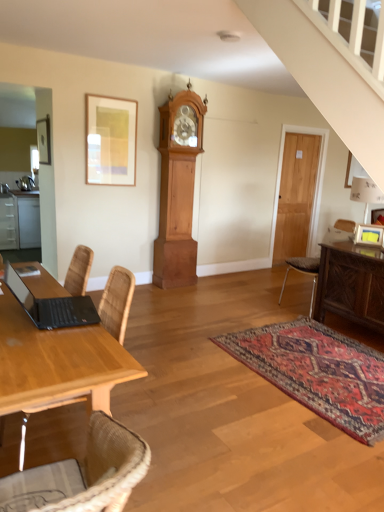
Question: Relative to wooden door at right, is wooden table at left in front or behind?

Choices:
 (A) front
 (B) behind

Answer: (A)

Question: Do you think wooden table at left is within wooden door at right, or outside of it?

Choices:
 (A) outside
 (B) inside

Answer: (A)

Question: Which of these objects is positioned closest to the wooden door at right?

Choices:
 (A) satin white cabinets at left
 (B) brown leather chair at right
 (C) matte gold picture frame at upper left
 (D) light brown wood grandfather clock at center
 (E) carved wood sideboard at right

Answer: (D)

Question: Which object is the closest to the matte gold picture frame at upper left?

Choices:
 (A) satin white cabinets at left
 (B) carved wood sideboard at right
 (C) black matte laptop at lower left
 (D) wooden table at left
 (E) wooden door at right

Answer: (C)